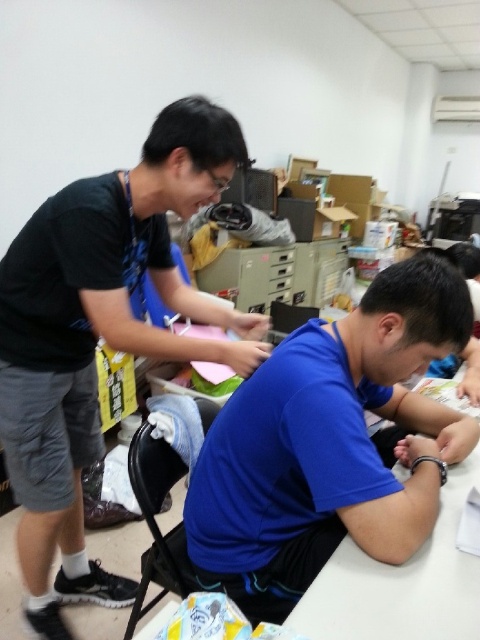
You are a photographer setting up a shoot in the described room. You want to ensure that both the blue matte shirt at center and the black matte shirt at left are visible in the frame. Considering their heights, which shirt should you position closer to the camera to avoid one blocking the other?

The blue matte shirt at center is shorter than the black matte shirt at left. To prevent the taller black matte shirt at left from blocking the shorter blue matte shirt at center, position the blue matte shirt at center closer to the camera.

You are taking a photo of the two points in the scene. Which point, point (351, 378) or point (453, 637), will appear larger in the photo?

Point (351, 378) is further to the camera than point (453, 637). Since objects closer to the camera appear larger, point (351, 378) will appear larger in the photo.